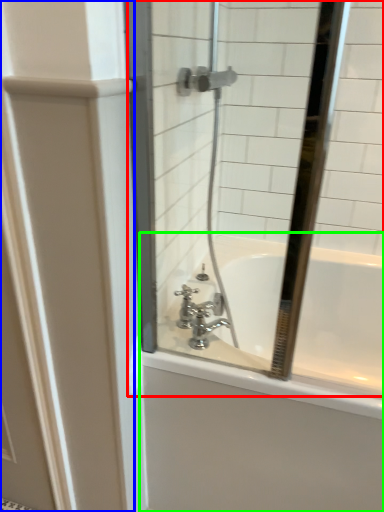
Question: Considering the real-world distances, which object is farthest from mirror (highlighted by a red box)? screen door (highlighted by a blue box) or bathtub (highlighted by a green box)?

Choices:
 (A) screen door
 (B) bathtub

Answer: (A)